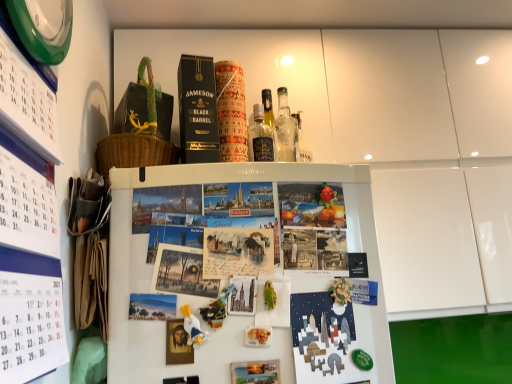
Question: Looking at their shapes, would you say white paper calendar at left is wider or thinner than white matte refrigerator at center?

Choices:
 (A) wide
 (B) thin

Answer: (B)

Question: In the image, is white paper calendar at left on the left side or the right side of white matte refrigerator at center?

Choices:
 (A) right
 (B) left

Answer: (B)

Question: Considering the real-world distances, which object is farthest from the matte paper postcard at upper center?

Choices:
 (A) translucent glass bottle at center
 (B) vintage paper postcard at center, which is the second book cover in right-to-left order
 (C) green plastic clock at upper left
 (D) white paper calendar at left
 (E) matte paper book cover at center, arranged as the first book cover when ordered from the bottom

Answer: (C)

Question: Based on their relative distances, which object is nearer to the matte paper postcard at upper center?

Choices:
 (A) vintage paper postcard at center, which is the second book cover in right-to-left order
 (B) white matte refrigerator at center
 (C) white paper calendar at left
 (D) green plastic clock at upper left
 (E) translucent glass bottle at center

Answer: (B)